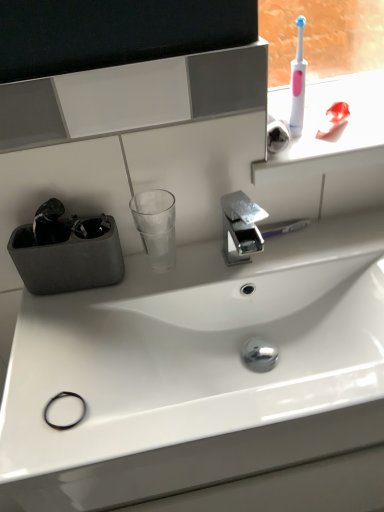
Identify the location of free region on the left part of polished chrome tap at center. (167, 283).